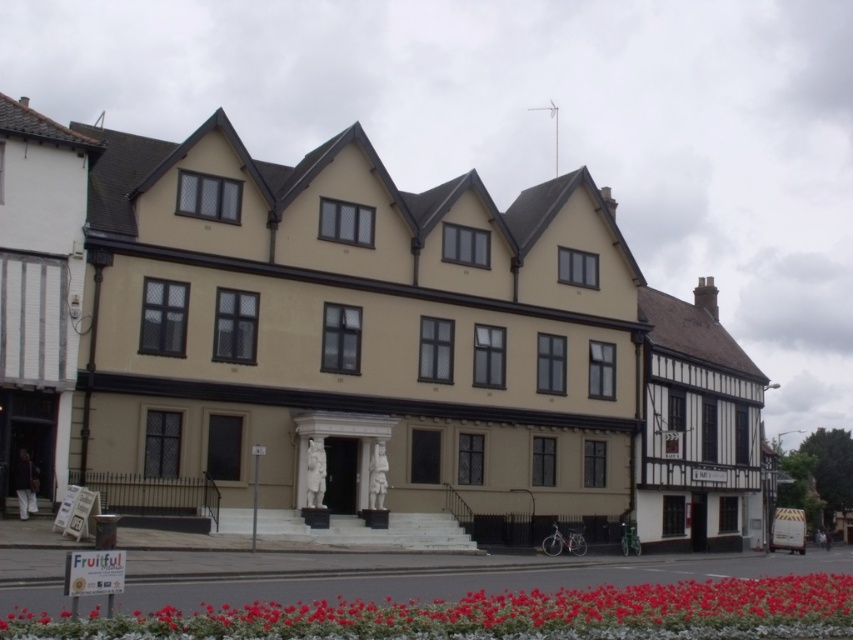
You are standing at the entrance of the building and want to walk to the flowerbed with red flowers. Which point, point (212, 474) or point (16, 106), is closer to your current position?

Point (16, 106) is closer to your current position at the entrance because it is in front of point (212, 474).